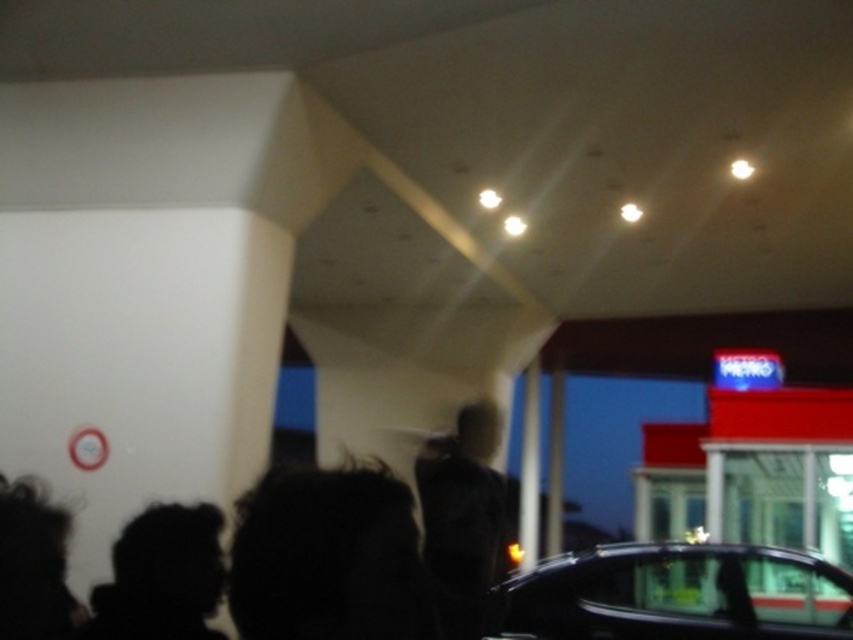
You are a security guard patrolling the area outside the building. You notice the dark matte jacket at center and the black silhouette at lower left. Which object is located closer to the ground?

The dark matte jacket at center is positioned under the black silhouette at lower left, meaning it is closer to the ground.

You are driving a car that is 2 meters long and want to park it between the shiny black car at lower right and the black silhouette at lower left. Can you fit your car in that space?

The distance between the shiny black car at lower right and the black silhouette at lower left is 3.89 meters. Since your car is 2 meters long, there is enough space to park it between them.